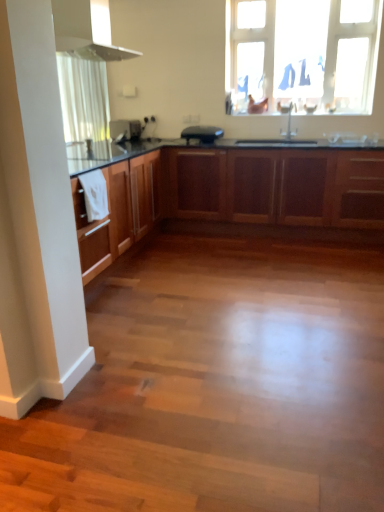
Question: From a real-world perspective, is black matte toaster at center, placed as the first appliance when sorted from right to left, positioned under transparent plastic window at upper center based on gravity?

Choices:
 (A) no
 (B) yes

Answer: (B)

Question: Is black matte toaster at center, placed as the first appliance when sorted from right to left, positioned far away from transparent plastic window at upper center?

Choices:
 (A) no
 (B) yes

Answer: (B)

Question: Can you confirm if black matte toaster at center, the 2th appliance positioned from the left, is positioned to the right of transparent plastic window at upper center?

Choices:
 (A) no
 (B) yes

Answer: (A)

Question: Is black matte toaster at center, placed as the first appliance when sorted from right to left, turned away from transparent plastic window at upper center?

Choices:
 (A) no
 (B) yes

Answer: (A)

Question: Considering the relative sizes of black matte toaster at center, placed as the first appliance when sorted from right to left, and transparent plastic window at upper center in the image provided, is black matte toaster at center, placed as the first appliance when sorted from right to left, shorter than transparent plastic window at upper center?

Choices:
 (A) yes
 (B) no

Answer: (A)

Question: Is point (81, 67) positioned closer to the camera than point (283, 103)?

Choices:
 (A) farther
 (B) closer

Answer: (A)

Question: Looking at their shapes, would you say white sheer curtain at upper left is wider or thinner than satin nickel faucet at upper center?

Choices:
 (A) wide
 (B) thin

Answer: (A)

Question: Is white sheer curtain at upper left situated inside satin nickel faucet at upper center or outside?

Choices:
 (A) outside
 (B) inside

Answer: (A)

Question: From a real-world perspective, is white sheer curtain at upper left above or below satin nickel faucet at upper center?

Choices:
 (A) above
 (B) below

Answer: (A)

Question: Is point (289, 120) positioned closer to the camera than point (110, 132)?

Choices:
 (A) farther
 (B) closer

Answer: (B)

Question: In terms of height, does satin nickel faucet at upper center look taller or shorter compared to satin black toaster at center, the 1th appliance viewed from the left?

Choices:
 (A) tall
 (B) short

Answer: (A)

Question: Based on their positions, is satin nickel faucet at upper center located to the left or right of satin black toaster at center, which is the second appliance in right-to-left order?

Choices:
 (A) left
 (B) right

Answer: (B)

Question: From the image's perspective, is satin nickel faucet at upper center positioned above or below satin black toaster at center, which is the second appliance in right-to-left order?

Choices:
 (A) below
 (B) above

Answer: (A)

Question: From a real-world perspective, is wooden cabinets at center positioned above or below white sheer curtain at upper left?

Choices:
 (A) below
 (B) above

Answer: (A)

Question: Would you say wooden cabinets at center is inside or outside white sheer curtain at upper left?

Choices:
 (A) inside
 (B) outside

Answer: (B)